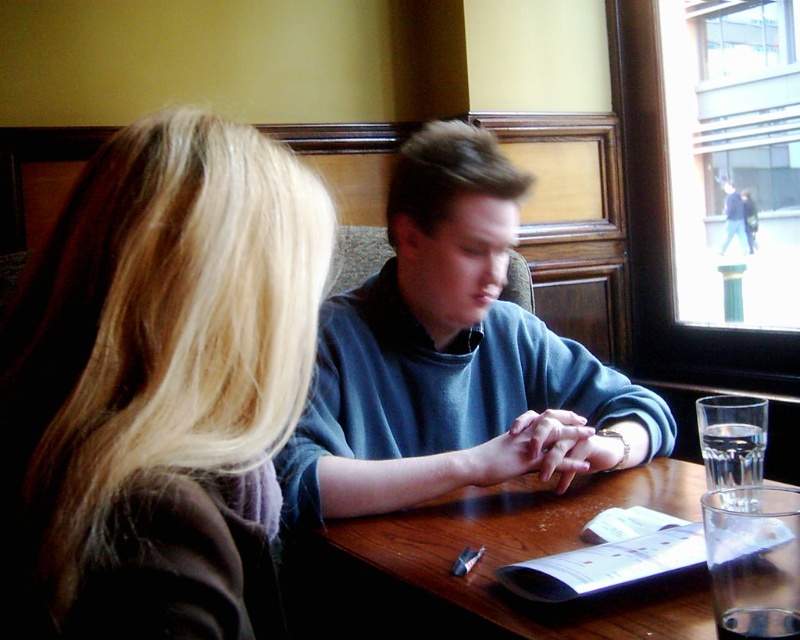
Question: Does blonde hair at upper left appear under blue cotton shirt at center?

Choices:
 (A) no
 (B) yes

Answer: (B)

Question: Is blue matte sweater at center wider than matte blue sweater at center?

Choices:
 (A) yes
 (B) no

Answer: (A)

Question: Which of these objects is positioned farthest from the matte blue sweater at center?

Choices:
 (A) blue cotton shirt at center
 (B) blue matte sweater at center
 (C) wooden table at center
 (D) blonde hair at upper left

Answer: (D)

Question: Which object is farther from the camera taking this photo?

Choices:
 (A) blue cotton shirt at center
 (B) blue matte sweater at center
 (C) wooden table at center

Answer: (A)

Question: Does blonde hair at upper left appear on the left side of matte blue sweater at center?

Choices:
 (A) no
 (B) yes

Answer: (B)

Question: Estimate the real-world distances between objects in this image. Which object is farther from the blue cotton shirt at center?

Choices:
 (A) matte blue sweater at center
 (B) blonde hair at upper left
 (C) wooden table at center

Answer: (B)